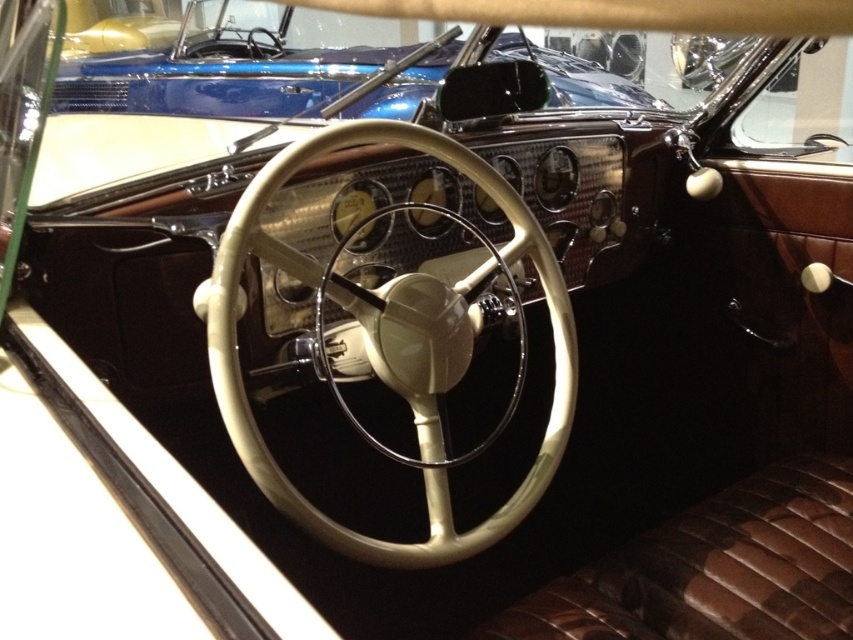
Is beige leather steering wheel at center closer to camera compared to metallic blue car at upper center?

That is True.

Which is in front, point (267, 480) or point (103, 74)?

Point (267, 480)

Identify the location of beige leather steering wheel at center. (317, 284).